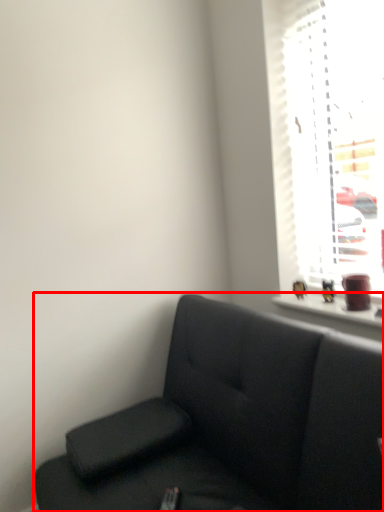
Question: Where is studio couch (annotated by the red box) located in relation to window in the image?

Choices:
 (A) left
 (B) right

Answer: (A)